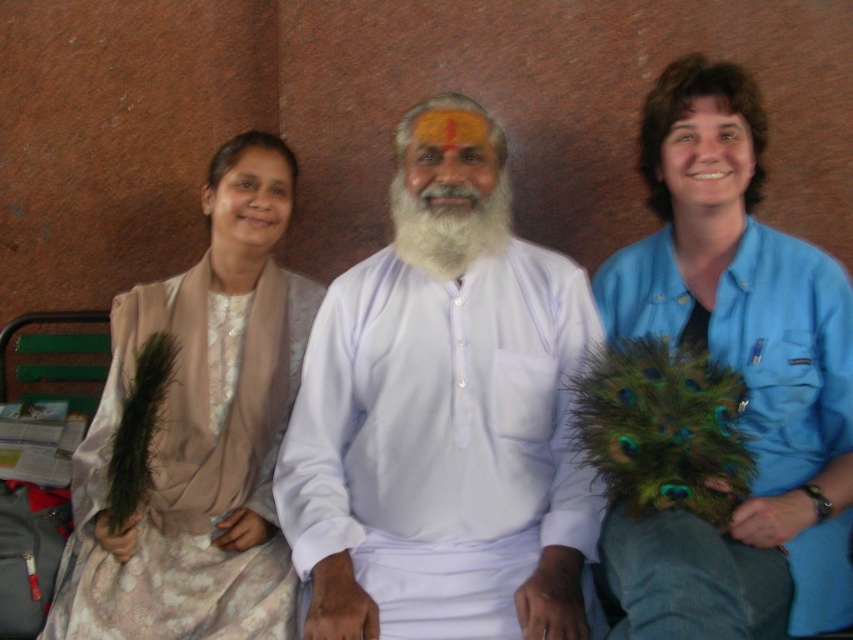
Question: Can you confirm if white matte shirt at center is positioned to the left of green feathered mask at right?

Choices:
 (A) no
 (B) yes

Answer: (B)

Question: Does white matte shirt at center have a smaller size compared to matte beige scarf at left?

Choices:
 (A) yes
 (B) no

Answer: (A)

Question: Is white matte shirt at center to the right of green feathered mask at right from the viewer's perspective?

Choices:
 (A) yes
 (B) no

Answer: (B)

Question: Which point is closer to the camera taking this photo?

Choices:
 (A) (518, 365)
 (B) (397, 252)
 (C) (659, 305)

Answer: (A)

Question: Which of the following is the farthest from the observer?

Choices:
 (A) (434, 228)
 (B) (277, 368)
 (C) (792, 483)
 (D) (444, 104)

Answer: (B)

Question: Among these points, which one is nearest to the camera?

Choices:
 (A) (318, 499)
 (B) (281, 170)
 (C) (434, 195)
 (D) (838, 589)

Answer: (D)